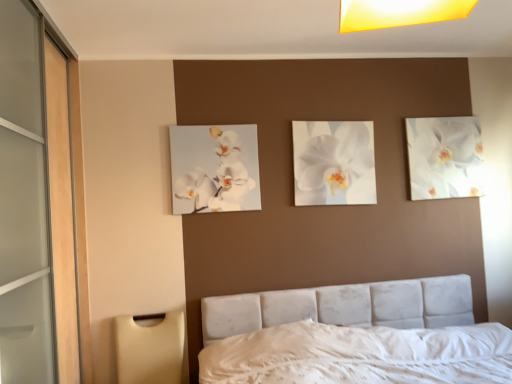
Describe the element at coordinates (214, 168) in the screenshot. I see `white glossy orchid at upper left, arranged as the 3th flower when viewed from the right` at that location.

At what (x,y) coordinates should I click in order to perform the action: click on white glossy orchid at upper left, positioned as the 3th flower in back-to-front order. Please return your answer as a coordinate pair (x, y). Looking at the image, I should click on (214, 168).

Find the location of a particular element. The image size is (512, 384). velvet white bed at center is located at coordinates (354, 336).

This screenshot has width=512, height=384. In order to click on white glossy orchid at upper left, positioned as the 3th flower in back-to-front order in this screenshot , I will do `click(214, 168)`.

Is velvet white bed at center surrounding white glossy orchid at center, acting as the second flower starting from the back?

No.

Between velvet white bed at center and white glossy orchid at center, acting as the second flower starting from the back, which one has larger size?

Bigger between the two is velvet white bed at center.

Where is `the 1st flower to the left when counting from the velvet white bed at center`? the 1st flower to the left when counting from the velvet white bed at center is located at coordinates coord(334,163).

Which is in front, velvet white bed at center or white glossy orchid at center, marked as the 2th flower in a left-to-right arrangement?

velvet white bed at center is in front.

Is white glossy orchid at upper left, the 1th flower viewed from the left, far from white glossy orchid at center, placed as the 2th flower when sorted from right to left?

They are positioned close to each other.

From a real-world perspective, is white glossy orchid at upper left, the 1th flower viewed from the left, on top of white glossy orchid at center, which is the second flower from front to back?

Actually, white glossy orchid at upper left, the 1th flower viewed from the left, is physically below white glossy orchid at center, which is the second flower from front to back, in the real world.

Considering the sizes of objects white glossy orchid at upper left, the 1th flower viewed from the left, and white glossy orchid at center, acting as the second flower starting from the back, in the image provided, who is thinner, white glossy orchid at upper left, the 1th flower viewed from the left, or white glossy orchid at center, acting as the second flower starting from the back,?

Thinner between the two is white glossy orchid at center, acting as the second flower starting from the back.

Is white glossy orchid at upper left, the 1th flower viewed from the left, shorter than white glossy orchid at center, which is the second flower from front to back?

Indeed, white glossy orchid at upper left, the 1th flower viewed from the left, has a lesser height compared to white glossy orchid at center, which is the second flower from front to back.

From the image's perspective, is velvet white bed at center located above white glossy orchid at upper left, arranged as the 3th flower when viewed from the right?

Incorrect, from the image's perspective, velvet white bed at center is lower than white glossy orchid at upper left, arranged as the 3th flower when viewed from the right.

You are a GUI agent. You are given a task and a screenshot of the screen. Output one action in this format:
    pyautogui.click(x=<x>, y=<y>)
    Task: Click on the bed lying below the white glossy orchid at upper left, the 1th flower viewed from the left (from the image's perspective)
    
    Given the screenshot: What is the action you would take?
    pyautogui.click(x=354, y=336)

Considering the sizes of objects velvet white bed at center and white glossy orchid at upper left, arranged as the 3th flower when viewed from the right, in the image provided, who is bigger, velvet white bed at center or white glossy orchid at upper left, arranged as the 3th flower when viewed from the right,?

velvet white bed at center.

Which of these two, velvet white bed at center or white glossy orchid at upper left, which appears as the first flower when viewed from the front, is thinner?

With smaller width is white glossy orchid at upper left, which appears as the first flower when viewed from the front.

How many degrees apart are the facing directions of white glossy orchid at upper right, which ranks as the third flower in front-to-back order, and white glossy orchid at center, placed as the 2th flower when sorted from right to left?

The angle between the facing direction of white glossy orchid at upper right, which ranks as the third flower in front-to-back order, and the facing direction of white glossy orchid at center, placed as the 2th flower when sorted from right to left, is 0.0177 degrees.

Considering their positions, is white glossy orchid at upper right, the 1th flower in the back-to-front sequence, located in front of or behind white glossy orchid at center, which is the second flower from front to back?

Clearly, white glossy orchid at upper right, the 1th flower in the back-to-front sequence, is behind white glossy orchid at center, which is the second flower from front to back.

Does white glossy orchid at upper right, the 1th flower in the back-to-front sequence, turn towards white glossy orchid at center, placed as the 2th flower when sorted from right to left?

No, white glossy orchid at upper right, the 1th flower in the back-to-front sequence, is not oriented towards white glossy orchid at center, placed as the 2th flower when sorted from right to left.

In the scene shown: Is white glossy orchid at upper right, the third flower when ordered from left to right, thinner than white glossy orchid at center, which is the second flower from front to back?

No, white glossy orchid at upper right, the third flower when ordered from left to right, is not thinner than white glossy orchid at center, which is the second flower from front to back.

From a real-world perspective, is velvet white bed at center positioned under beige plastic lampshade at lower left based on gravity?

Yes, from a real-world perspective, velvet white bed at center is beneath beige plastic lampshade at lower left.

The width and height of the screenshot is (512, 384). Identify the location of lamp to the left of velvet white bed at center. (150, 349).

Is velvet white bed at center situated inside beige plastic lampshade at lower left or outside?

velvet white bed at center is located beyond the bounds of beige plastic lampshade at lower left.

Does velvet white bed at center turn towards beige plastic lampshade at lower left?

No.

Are white glossy orchid at upper right, which ranks as the third flower in front-to-back order, and white glossy orchid at upper left, arranged as the 3th flower when viewed from the right, located far from each other?

Yes, white glossy orchid at upper right, which ranks as the third flower in front-to-back order, and white glossy orchid at upper left, arranged as the 3th flower when viewed from the right, are located far from each other.

From a real-world perspective, between white glossy orchid at upper right, the 1th flower in the back-to-front sequence, and white glossy orchid at upper left, arranged as the 3th flower when viewed from the right, who is vertically higher?

white glossy orchid at upper right, the 1th flower in the back-to-front sequence, from a real-world perspective.

From the image's perspective, relative to white glossy orchid at upper left, the 1th flower viewed from the left, is white glossy orchid at upper right, which ranks as the third flower in front-to-back order, above or below?

Clearly, from the image's perspective, white glossy orchid at upper right, which ranks as the third flower in front-to-back order, is above white glossy orchid at upper left, the 1th flower viewed from the left.

Considering the relative sizes of white glossy orchid at upper right, which ranks as the third flower in front-to-back order, and white glossy orchid at upper left, positioned as the 3th flower in back-to-front order, in the image provided, is white glossy orchid at upper right, which ranks as the third flower in front-to-back order, bigger than white glossy orchid at upper left, positioned as the 3th flower in back-to-front order,?

Indeed, white glossy orchid at upper right, which ranks as the third flower in front-to-back order, has a larger size compared to white glossy orchid at upper left, positioned as the 3th flower in back-to-front order.

Which object is closer to the camera taking this photo, beige plastic lampshade at lower left or white glossy orchid at upper right, which ranks as the third flower in front-to-back order?

beige plastic lampshade at lower left.

Does beige plastic lampshade at lower left appear on the right side of white glossy orchid at upper right, the 1th flower in the back-to-front sequence?

Incorrect, beige plastic lampshade at lower left is not on the right side of white glossy orchid at upper right, the 1th flower in the back-to-front sequence.

Does point (119, 375) lie behind point (474, 144)?

No, (119, 375) is closer to viewer.

From a real-world perspective, does beige plastic lampshade at lower left stand above white glossy orchid at upper right, placed as the 1th flower when sorted from right to left?

No, from a real-world perspective, beige plastic lampshade at lower left is not on top of white glossy orchid at upper right, placed as the 1th flower when sorted from right to left.

The image size is (512, 384). In order to click on the 1st flower counting from the left side of the velvet white bed at center in this screenshot , I will do `click(334, 163)`.

At what (x,y) coordinates should I click in order to perform the action: click on flower located underneath the white glossy orchid at center, acting as the second flower starting from the back (from a real-world perspective). Please return your answer as a coordinate pair (x, y). Image resolution: width=512 pixels, height=384 pixels. Looking at the image, I should click on (214, 168).

Considering their positions, is beige plastic lampshade at lower left positioned further to white glossy orchid at upper left, which appears as the first flower when viewed from the front, than white glossy orchid at upper right, the third flower when ordered from left to right?

Based on the image, white glossy orchid at upper right, the third flower when ordered from left to right, appears to be further to white glossy orchid at upper left, which appears as the first flower when viewed from the front.

From the image, which object appears to be nearer to beige plastic lampshade at lower left, white glossy orchid at center, marked as the 2th flower in a left-to-right arrangement, or white glossy orchid at upper left, which appears as the first flower when viewed from the front?

white glossy orchid at upper left, which appears as the first flower when viewed from the front, lies closer to beige plastic lampshade at lower left than the other object.

When comparing their distances from velvet white bed at center, does beige plastic lampshade at lower left or white glossy orchid at upper right, the third flower when ordered from left to right, seem further?

The object further to velvet white bed at center is white glossy orchid at upper right, the third flower when ordered from left to right.

Looking at the image, which one is located further to white glossy orchid at upper left, which appears as the first flower when viewed from the front, white glossy orchid at center, placed as the 2th flower when sorted from right to left, or white glossy orchid at upper right, the third flower when ordered from left to right?

white glossy orchid at upper right, the third flower when ordered from left to right, lies further to white glossy orchid at upper left, which appears as the first flower when viewed from the front, than the other object.

From the image, which object appears to be farther from white glossy orchid at center, placed as the 2th flower when sorted from right to left, white glossy orchid at upper left, positioned as the 3th flower in back-to-front order, or white glossy orchid at upper right, which ranks as the third flower in front-to-back order?

Among the two, white glossy orchid at upper right, which ranks as the third flower in front-to-back order, is located further to white glossy orchid at center, placed as the 2th flower when sorted from right to left.

Looking at the image, which one is located further to white glossy orchid at upper left, arranged as the 3th flower when viewed from the right, velvet white bed at center or white glossy orchid at upper right, placed as the 1th flower when sorted from right to left?

The object further to white glossy orchid at upper left, arranged as the 3th flower when viewed from the right, is white glossy orchid at upper right, placed as the 1th flower when sorted from right to left.

Considering their positions, is beige plastic lampshade at lower left positioned further to velvet white bed at center than white glossy orchid at upper left, arranged as the 3th flower when viewed from the right?

white glossy orchid at upper left, arranged as the 3th flower when viewed from the right, is further to velvet white bed at center.

Which object lies further to the anchor point beige plastic lampshade at lower left, velvet white bed at center or white glossy orchid at upper right, placed as the 1th flower when sorted from right to left?

Based on the image, white glossy orchid at upper right, placed as the 1th flower when sorted from right to left, appears to be further to beige plastic lampshade at lower left.

Where is `flower located between velvet white bed at center and white glossy orchid at center, acting as the second flower starting from the back, in the depth direction`? This screenshot has height=384, width=512. flower located between velvet white bed at center and white glossy orchid at center, acting as the second flower starting from the back, in the depth direction is located at coordinates (214, 168).

The image size is (512, 384). Find the location of `flower between white glossy orchid at center, placed as the 2th flower when sorted from right to left, and beige plastic lampshade at lower left from top to bottom`. flower between white glossy orchid at center, placed as the 2th flower when sorted from right to left, and beige plastic lampshade at lower left from top to bottom is located at coordinates (214, 168).

Where is `lamp between velvet white bed at center and white glossy orchid at upper left, arranged as the 3th flower when viewed from the right, along the z-axis`? The height and width of the screenshot is (384, 512). lamp between velvet white bed at center and white glossy orchid at upper left, arranged as the 3th flower when viewed from the right, along the z-axis is located at coordinates (150, 349).

The height and width of the screenshot is (384, 512). I want to click on bed between beige plastic lampshade at lower left and white glossy orchid at upper right, which ranks as the third flower in front-to-back order, so click(x=354, y=336).